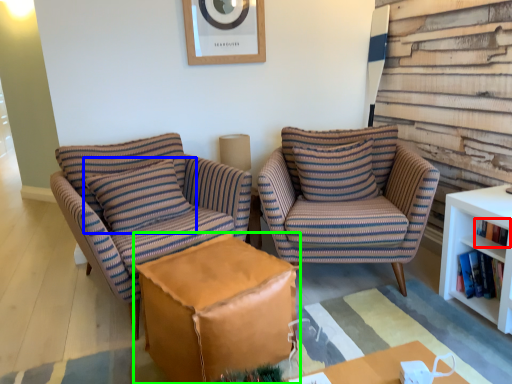
Question: Estimate the real-world distances between objects in this image. Which object is closer to book (highlighted by a red box), pillow (highlighted by a blue box) or table (highlighted by a green box)?

Choices:
 (A) pillow
 (B) table

Answer: (B)